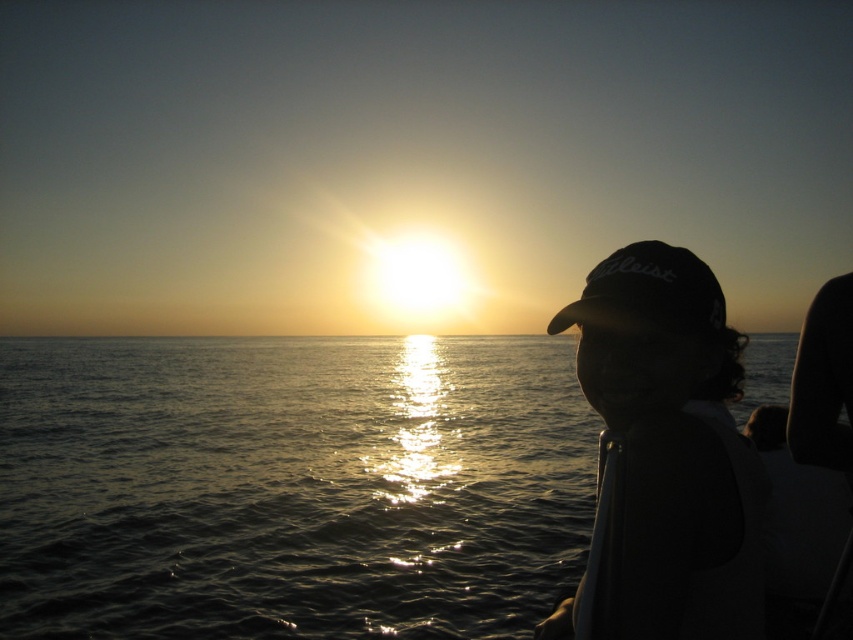
In the scene shown: Between shiny reflective water at center and black matte baseball cap at right, which one has less height?

black matte baseball cap at right

Is shiny reflective water at center taller than black matte baseball cap at right?

Yes.

Which is behind, point (93, 570) or point (671, 428)?

The point (93, 570) is more distant.

Image resolution: width=853 pixels, height=640 pixels. In order to click on shiny reflective water at center in this screenshot , I will do `click(289, 486)`.